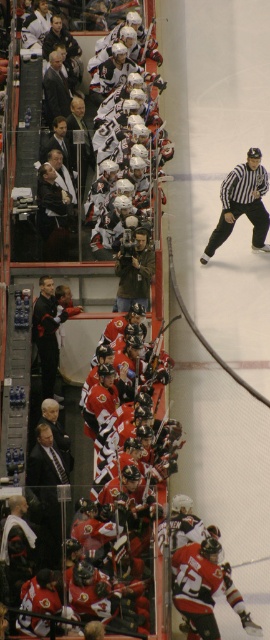
Is orange jersey at center taller than black jersey at center?

Incorrect, orange jersey at center's height is not larger of black jersey at center's.

Between orange jersey at center and black jersey at center, which one has more height?

black jersey at center is taller.

Locate an element on the screen. This screenshot has width=270, height=640. orange jersey at center is located at coordinates (204, 588).